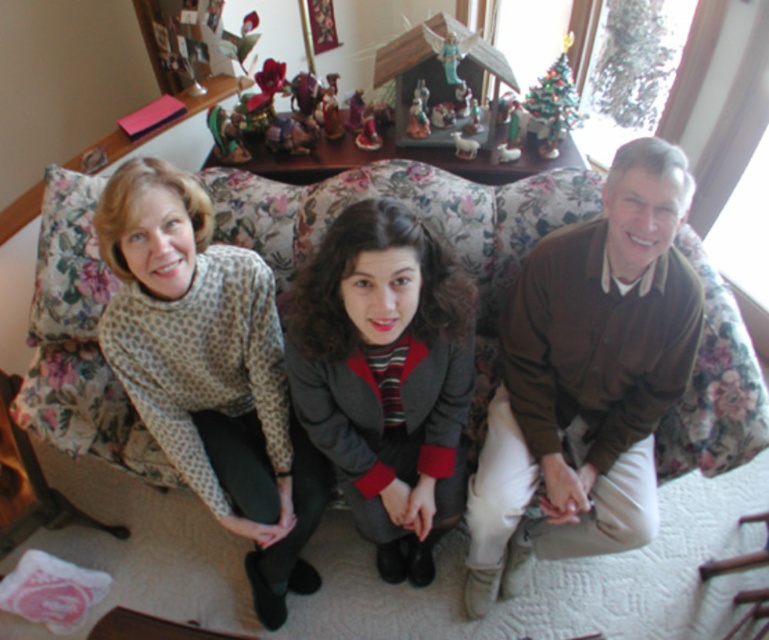
Does brown cotton shirt at right appear under gray wool blazer at center?

Incorrect, brown cotton shirt at right is not positioned below gray wool blazer at center.

Is brown cotton shirt at right thinner than gray wool blazer at center?

No.

Does point (498, 541) come closer to viewer compared to point (391, 292)?

That is False.

Where is `brown cotton shirt at right`? brown cotton shirt at right is located at coordinates (586, 380).

Who is more distant from viewer, (288,502) or (385,461)?

The point (288,502) is more distant.

Is printed sweater at left bigger than gray wool blazer at center?

Yes, printed sweater at left is bigger than gray wool blazer at center.

Find the location of `printed sweater at left`. printed sweater at left is located at coordinates (210, 371).

Where is `printed sweater at left`? The height and width of the screenshot is (640, 769). printed sweater at left is located at coordinates (210, 371).

Is point (608, 488) farther from viewer compared to point (195, 237)?

Yes, it is.

Is point (305, 273) less distant than point (305, 582)?

Yes, it is in front of point (305, 582).

At what (x,y) coordinates should I click in order to perform the action: click on patterned sweater at center. Please return your answer as a coordinate pair (x, y). This screenshot has width=769, height=640. Looking at the image, I should click on (588, 378).